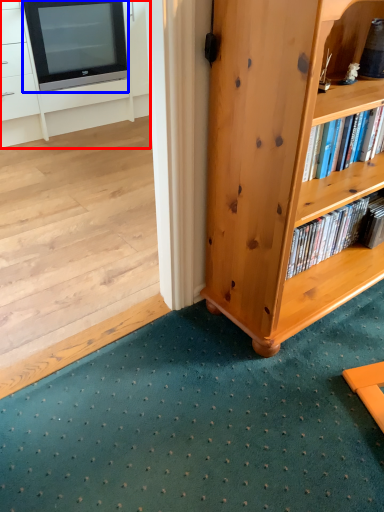
Question: Which object appears farthest to the camera in this image, cabinetry (highlighted by a red box) or television (highlighted by a blue box)?

Choices:
 (A) cabinetry
 (B) television

Answer: (B)